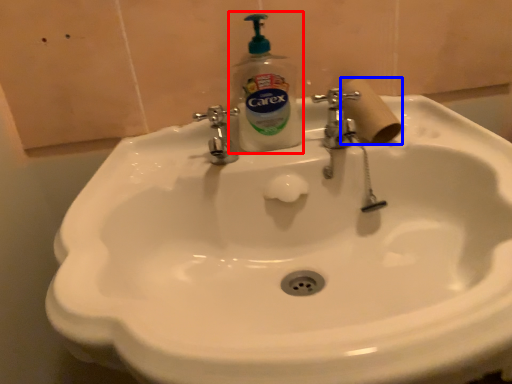
Question: Which object appears closest to the camera in this image, soap dispenser (highlighted by a red box) or toilet paper (highlighted by a blue box)?

Choices:
 (A) soap dispenser
 (B) toilet paper

Answer: (A)